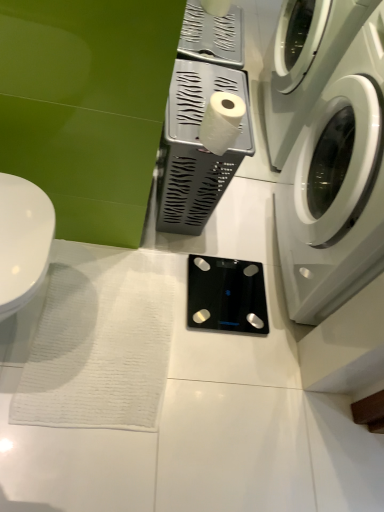
Locate an element on the screen. Image resolution: width=384 pixels, height=512 pixels. free space between white glossy washing machine at right and white plastic tissue holder at center, placed as the first appliance when sorted from top to bottom is located at coordinates (219, 222).